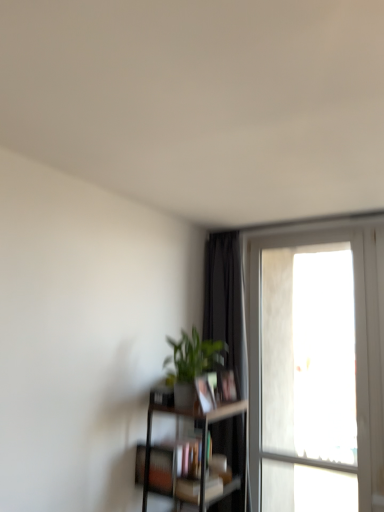
I want to click on matte black bookshelf at lower center, arranged as the 2th book when ordered from the bottom, so click(161, 468).

Measure the distance between point (201, 375) and camera.

7.80 feet.

This screenshot has height=512, width=384. What do you see at coordinates (205, 393) in the screenshot? I see `matte black book at center, placed as the 1th book when sorted from top to bottom` at bounding box center [205, 393].

Describe the element at coordinates (201, 449) in the screenshot. This screenshot has width=384, height=512. I see `dark brown wooden shelf at lower center` at that location.

Identify the location of hardcover book at center, the 4th book viewed from the top. (188, 490).

Between point (234, 402) and point (221, 483), which one is positioned behind?

The point (234, 402) is behind.

From the image's perspective, is dark brown wooden shelf at lower center located above or below hardcover book at center, which is the 1th book from bottom to top?

dark brown wooden shelf at lower center is situated higher than hardcover book at center, which is the 1th book from bottom to top, in the image.

Does dark brown wooden shelf at lower center come in front of hardcover book at center, the 4th book viewed from the top?

Yes, dark brown wooden shelf at lower center is in front of hardcover book at center, the 4th book viewed from the top.

Which is correct: dark brown wooden shelf at lower center is inside green matte plant at center, or outside of it?

dark brown wooden shelf at lower center lies outside green matte plant at center.

Is dark brown wooden shelf at lower center beside green matte plant at center?

dark brown wooden shelf at lower center is not next to green matte plant at center, and they're not touching.

Find the location of a particular element. shelf located in front of the green matte plant at center is located at coordinates (201, 449).

Is dark brown wooden shelf at lower center facing towards green matte plant at center?

No, dark brown wooden shelf at lower center does not turn towards green matte plant at center.

From a real-world perspective, is matte black book at center, placed as the 1th book when sorted from top to bottom, below dark brown wooden shelf at lower center?

No, from a real-world perspective, matte black book at center, placed as the 1th book when sorted from top to bottom, is not under dark brown wooden shelf at lower center.

From the image's perspective, is matte black book at center, placed as the 1th book when sorted from top to bottom, below dark brown wooden shelf at lower center?

No.

Which is in front, matte black book at center, the 4th book when ordered from bottom to top, or dark brown wooden shelf at lower center?

dark brown wooden shelf at lower center.

Considering the sizes of objects matte black book at center, placed as the 1th book when sorted from top to bottom, and dark brown wooden shelf at lower center in the image provided, who is shorter, matte black book at center, placed as the 1th book when sorted from top to bottom, or dark brown wooden shelf at lower center?

matte black book at center, placed as the 1th book when sorted from top to bottom, is shorter.

From a real-world perspective, which is physically above, matte black book at center, placed as the 1th book when sorted from top to bottom, or clear glass window at right?

From a 3D spatial view, clear glass window at right is above.

Between point (204, 380) and point (346, 234), which one is positioned behind?

The point (346, 234) is farther.

What's the angular difference between matte black book at center, placed as the 1th book when sorted from top to bottom, and clear glass window at right's facing directions?

85.3 degrees.

How different are the orientations of matte black bookshelf at lower center, positioned as the 3th book in top-to-bottom order, and green matte plant at center in degrees?

They differ by 4.39 degrees in their facing directions.

Does matte black bookshelf at lower center, arranged as the 2th book when ordered from the bottom, have a greater height compared to green matte plant at center?

Incorrect, the height of matte black bookshelf at lower center, arranged as the 2th book when ordered from the bottom, is not larger of that of green matte plant at center.

Can you confirm if matte black bookshelf at lower center, positioned as the 3th book in top-to-bottom order, is positioned to the left of green matte plant at center?

Correct, you'll find matte black bookshelf at lower center, positioned as the 3th book in top-to-bottom order, to the left of green matte plant at center.

Can we say matte black bookshelf at lower center, arranged as the 2th book when ordered from the bottom, lies outside green matte plant at center?

Yes, matte black bookshelf at lower center, arranged as the 2th book when ordered from the bottom, is located beyond the bounds of green matte plant at center.

Visually, is green matte plant at center positioned to the left or to the right of matte black book at center, the 4th book when ordered from bottom to top?

In the image, green matte plant at center appears on the left side of matte black book at center, the 4th book when ordered from bottom to top.

From a real-world perspective, is green matte plant at center physically located above or below matte black book at center, placed as the 1th book when sorted from top to bottom?

In terms of real-world spatial position, green matte plant at center is above matte black book at center, placed as the 1th book when sorted from top to bottom.

Which point is more distant from viewer, (206, 347) or (204, 393)?

The point (206, 347) is more distant.

Does green matte plant at center have a lesser width compared to matte black book at center, placed as the 1th book when sorted from top to bottom?

No.

Can we say green matte plant at center lies outside matte black bookshelf at lower center, arranged as the 2th book when ordered from the bottom?

green matte plant at center is positioned outside matte black bookshelf at lower center, arranged as the 2th book when ordered from the bottom.

Is point (179, 368) closer or farther from the camera than point (152, 469)?

Point (179, 368) appears to be farther away from the viewer than point (152, 469).

From the image's perspective, count 3rd books downward from the green matte plant at center and point to it. Please provide its 2D coordinates.

[(161, 468)]

Is green matte plant at center to the right of matte black bookshelf at lower center, arranged as the 2th book when ordered from the bottom, from the viewer's perspective?

Correct, you'll find green matte plant at center to the right of matte black bookshelf at lower center, arranged as the 2th book when ordered from the bottom.

Locate an element on the screen. book located below the dark brown wooden shelf at lower center (from the image's perspective) is located at coordinates (188, 490).

I want to click on shelf in front of the green matte plant at center, so (x=201, y=449).

Which object lies nearer to the anchor point hardcover book at center, the second book in the top-to-bottom sequence, matte black bookshelf at lower center, arranged as the 2th book when ordered from the bottom, or clear glass window at right?

The object closer to hardcover book at center, the second book in the top-to-bottom sequence, is matte black bookshelf at lower center, arranged as the 2th book when ordered from the bottom.

Looking at the image, which one is located further to matte black bookshelf at lower center, positioned as the 3th book in top-to-bottom order, hardcover book at center, which is the 1th book from bottom to top, or matte black book at center, the 4th book when ordered from bottom to top?

matte black book at center, the 4th book when ordered from bottom to top, is positioned further to the anchor matte black bookshelf at lower center, positioned as the 3th book in top-to-bottom order.

Based on their spatial positions, is matte black book at center, the 4th book when ordered from bottom to top, or matte black bookshelf at lower center, positioned as the 3th book in top-to-bottom order, closer to hardcover book at center, the second book in the top-to-bottom sequence?

The object closer to hardcover book at center, the second book in the top-to-bottom sequence, is matte black book at center, the 4th book when ordered from bottom to top.

Estimate the real-world distances between objects in this image. Which object is closer to matte black bookshelf at lower center, arranged as the 2th book when ordered from the bottom, dark brown wooden shelf at lower center or matte black book at center, placed as the 1th book when sorted from top to bottom?

Among the two, dark brown wooden shelf at lower center is located nearer to matte black bookshelf at lower center, arranged as the 2th book when ordered from the bottom.

From the image, which object appears to be nearer to matte black bookshelf at lower center, arranged as the 2th book when ordered from the bottom, clear glass window at right or hardcover book at center, which is the 1th book from bottom to top?

hardcover book at center, which is the 1th book from bottom to top, is positioned closer to the anchor matte black bookshelf at lower center, arranged as the 2th book when ordered from the bottom.

Considering their positions, is matte black bookshelf at lower center, arranged as the 2th book when ordered from the bottom, positioned closer to matte black book at center, the 4th book when ordered from bottom to top, than dark brown wooden shelf at lower center?

Based on the image, dark brown wooden shelf at lower center appears to be nearer to matte black book at center, the 4th book when ordered from bottom to top.

From the image, which object appears to be farther from hardcover book at center, which is the 1th book from bottom to top, dark brown wooden shelf at lower center or hardcover book at center, arranged as the 3th book when ordered from the bottom?

hardcover book at center, arranged as the 3th book when ordered from the bottom, lies further to hardcover book at center, which is the 1th book from bottom to top, than the other object.

Considering their positions, is matte black book at center, the 4th book when ordered from bottom to top, positioned further to clear glass window at right than hardcover book at center, the second book in the top-to-bottom sequence?

matte black book at center, the 4th book when ordered from bottom to top, is positioned further to the anchor clear glass window at right.

Where is `book between matte black book at center, placed as the 1th book when sorted from top to bottom, and clear glass window at right from left to right`? book between matte black book at center, placed as the 1th book when sorted from top to bottom, and clear glass window at right from left to right is located at coordinates (226, 387).

What are the coordinates of `book between dark brown wooden shelf at lower center and matte black bookshelf at lower center, positioned as the 3th book in top-to-bottom order, in the front-back direction` in the screenshot? It's located at (188, 490).

Locate an element on the screen. The height and width of the screenshot is (512, 384). houseplant between matte black bookshelf at lower center, arranged as the 2th book when ordered from the bottom, and clear glass window at right from left to right is located at coordinates (191, 357).

Identify the location of book between matte black book at center, placed as the 1th book when sorted from top to bottom, and matte black bookshelf at lower center, arranged as the 2th book when ordered from the bottom, vertically. The height and width of the screenshot is (512, 384). (226, 387).